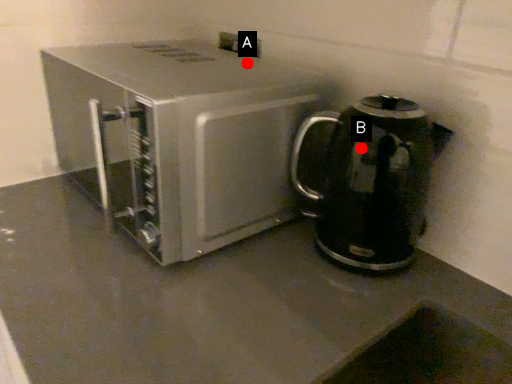
Question: Two points are circled on the image, labeled by A and B beside each circle. Among these points, which one is nearest to the camera?

Choices:
 (A) A is closer
 (B) B is closer

Answer: (B)